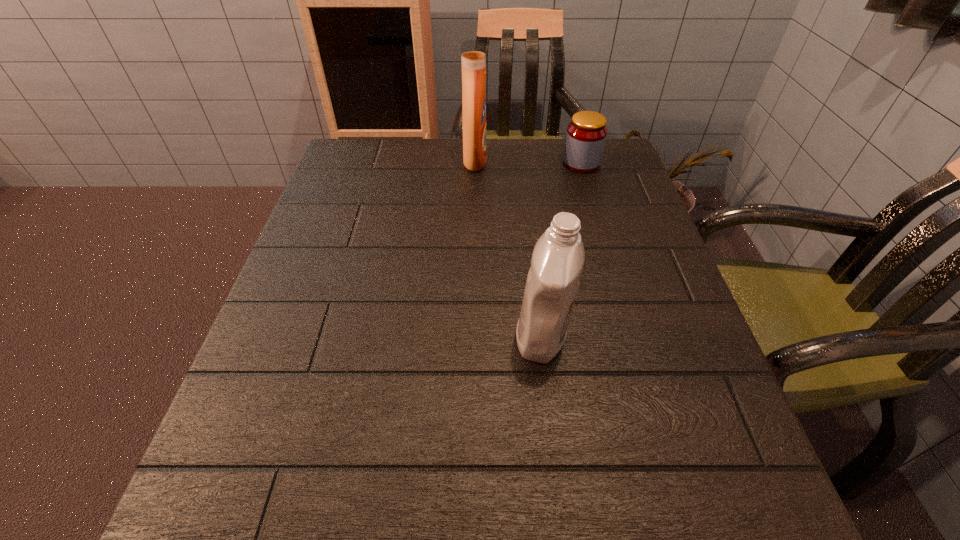
Where is `free spot that satisfies the following two spatial constraints: 1. on the back side of the shortest object; 2. on the right side of the right detergent`? The image size is (960, 540). free spot that satisfies the following two spatial constraints: 1. on the back side of the shortest object; 2. on the right side of the right detergent is located at coordinates (520, 164).

Find the location of a particular element. The height and width of the screenshot is (540, 960). free spot that satisfies the following two spatial constraints: 1. on the back side of the right detergent; 2. on the front-facing side of the farther detergent is located at coordinates point(520,161).

Where is `vacant area that satisfies the following two spatial constraints: 1. on the front-facing side of the second object from right to left; 2. on the right side of the leftmost object`? This screenshot has width=960, height=540. vacant area that satisfies the following two spatial constraints: 1. on the front-facing side of the second object from right to left; 2. on the right side of the leftmost object is located at coordinates pyautogui.click(x=472, y=336).

The image size is (960, 540). I want to click on free space that satisfies the following two spatial constraints: 1. on the front-facing side of the jar; 2. on the left side of the leftmost object, so click(475, 164).

The height and width of the screenshot is (540, 960). Find the location of `vacant point that satisfies the following two spatial constraints: 1. on the back side of the second object from right to left; 2. on the front-facing side of the left detergent`. vacant point that satisfies the following two spatial constraints: 1. on the back side of the second object from right to left; 2. on the front-facing side of the left detergent is located at coordinates (520, 161).

You are a GUI agent. You are given a task and a screenshot of the screen. Output one action in this format:
    pyautogui.click(x=<x>, y=<y>)
    Task: Click on the vacant space that satisfies the following two spatial constraints: 1. on the back side of the second object from right to left; 2. on the front-facing side of the leftmost object
    The image size is (960, 540).
    Given the screenshot: What is the action you would take?
    pyautogui.click(x=520, y=161)

The height and width of the screenshot is (540, 960). Find the location of `blank area in the image that satisfies the following two spatial constraints: 1. on the front-facing side of the farther detergent; 2. on the left side of the second object from right to left`. blank area in the image that satisfies the following two spatial constraints: 1. on the front-facing side of the farther detergent; 2. on the left side of the second object from right to left is located at coordinates (472, 336).

Where is `free space that satisfies the following two spatial constraints: 1. on the front-facing side of the right detergent; 2. on the left side of the farther detergent`? This screenshot has height=540, width=960. free space that satisfies the following two spatial constraints: 1. on the front-facing side of the right detergent; 2. on the left side of the farther detergent is located at coordinates (472, 336).

Image resolution: width=960 pixels, height=540 pixels. Find the location of `free region that satisfies the following two spatial constraints: 1. on the back side of the second object from left to right; 2. on the right side of the shortest object`. free region that satisfies the following two spatial constraints: 1. on the back side of the second object from left to right; 2. on the right side of the shortest object is located at coordinates (520, 164).

Identify the location of vacant region that satisfies the following two spatial constraints: 1. on the back side of the shortest object; 2. on the left side of the right detergent. The height and width of the screenshot is (540, 960). (520, 164).